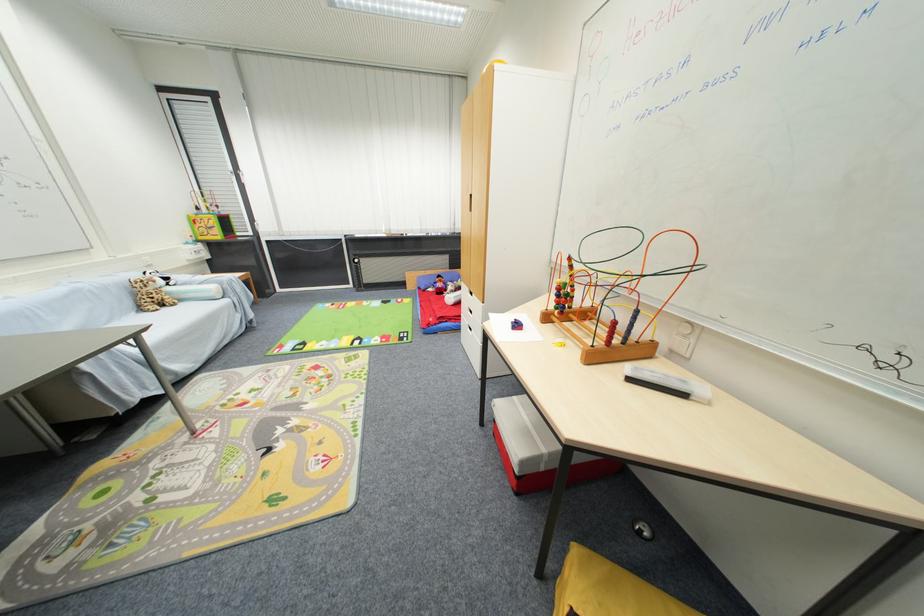
At what (x,y) coordinates should I click in order to perform the action: click on sofa sitting surface. Please return your answer as a coordinate pair (x, y). Looking at the image, I should click on (151, 318).